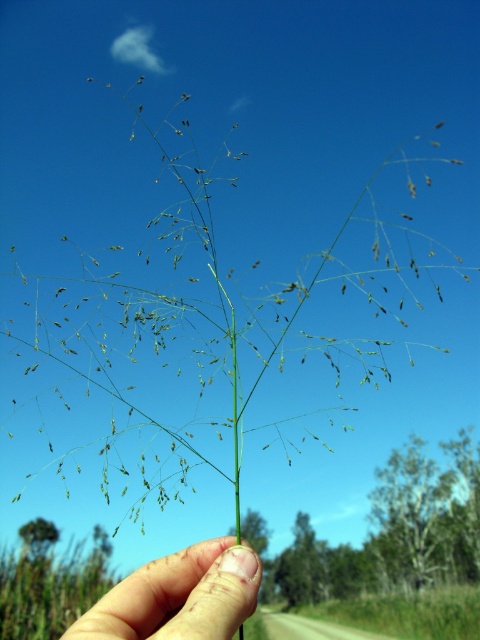
Question: Can you confirm if finger nail at center is bigger than green matte grass at center?

Choices:
 (A) no
 (B) yes

Answer: (A)

Question: Can you confirm if finger nail at center is positioned to the left of green matte grass at center?

Choices:
 (A) no
 (B) yes

Answer: (B)

Question: Which object is farther from the camera taking this photo?

Choices:
 (A) green matte grass at center
 (B) finger nail at center

Answer: (A)

Question: Among these points, which one is farthest from the camera?

Choices:
 (A) (190, 604)
 (B) (430, 604)

Answer: (B)

Question: Is finger nail at center wider than green matte grass at center?

Choices:
 (A) no
 (B) yes

Answer: (A)